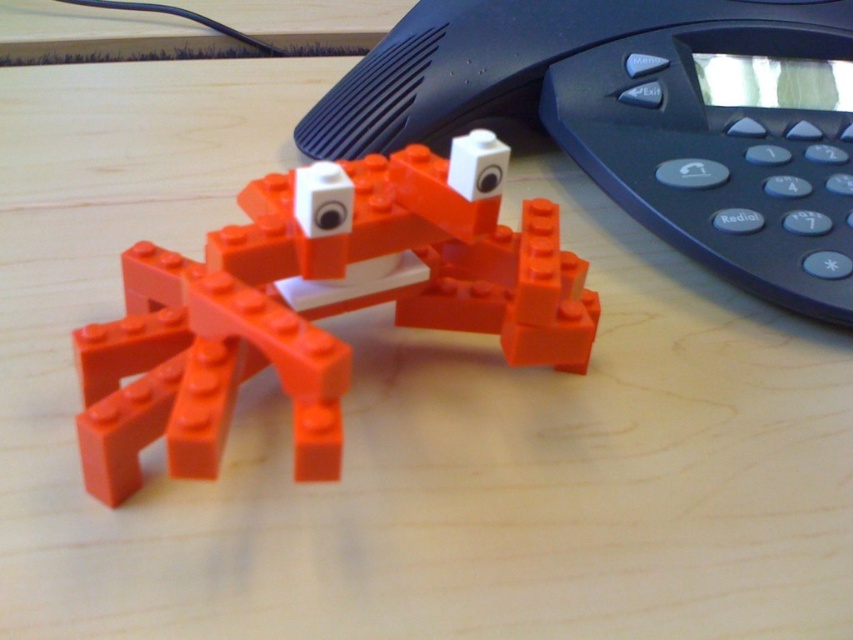
You are a delivery robot trying to reach the black plastic phone at upper center on a desk. There is an orange matte plastic crab at center in the way. Can you reach the phone without moving the crab?

The orange matte plastic crab at center is behind the black plastic phone at upper center, so the robot can reach the phone without moving the crab because the crab is not blocking the path.

You are organizing a desk and need to place both the black plastic phone at upper center and the orange matte plastic crab at center. Since the crab is smaller, can you fit both items side by side on a shelf that is exactly the width of the phone?

The black plastic phone at upper center is wider than the orange matte plastic crab at center. Since the shelf is exactly the width of the phone, there would not be enough space to fit both items side by side because the combined width of both items would exceed the shelf length.